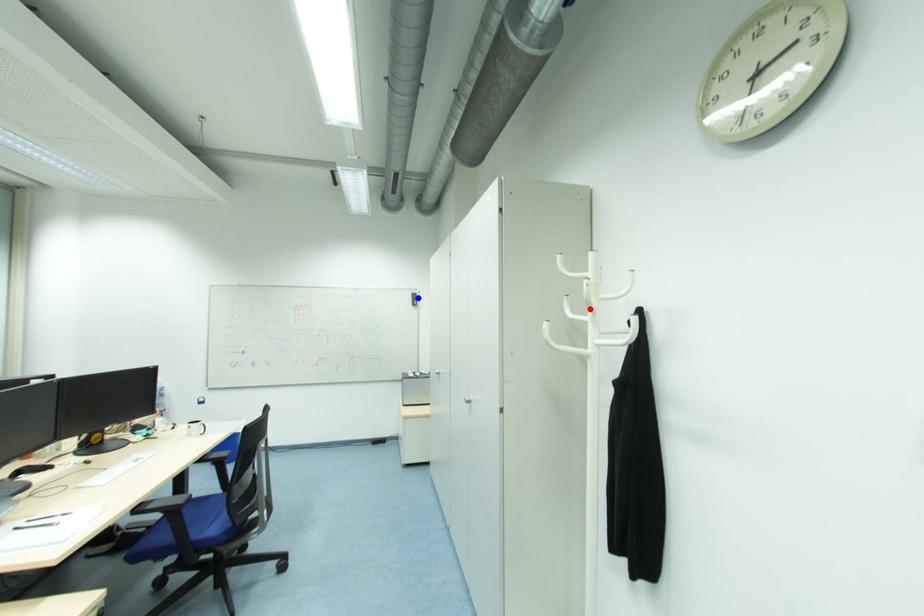
Question: Two points are marked on the image. Which point is closer to the camera?

Choices:
 (A) Blue point is closer.
 (B) Red point is closer.

Answer: (B)